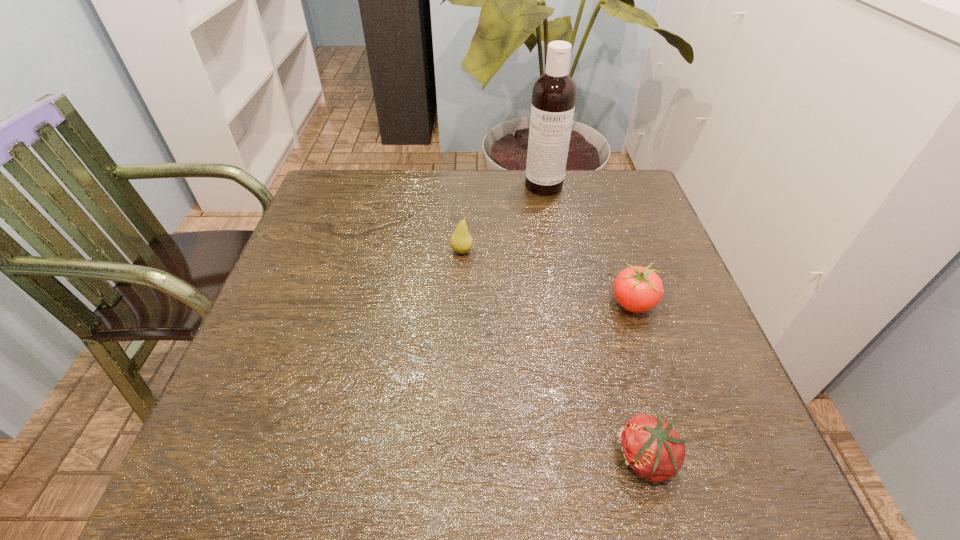
This screenshot has height=540, width=960. I want to click on vacant space located on the left of the taller tomato, so (499, 303).

The image size is (960, 540). In order to click on vacant space situated 0.110m on the back of the shorter tomato in this screenshot , I will do 623,372.

Where is `object situated at the far edge`? This screenshot has width=960, height=540. object situated at the far edge is located at coordinates (554, 93).

At what (x,y) coordinates should I click in order to perform the action: click on object that is at the near edge. Please return your answer as a coordinate pair (x, y). Looking at the image, I should click on (651, 448).

Find the location of a particular element. object at the near right corner is located at coordinates (651, 448).

At what (x,y) coordinates should I click in order to perform the action: click on free point at the far edge. Please return your answer as a coordinate pair (x, y). Looking at the image, I should click on (486, 174).

In the image, there is a desktop. Where is `vacant area at the near edge`? Image resolution: width=960 pixels, height=540 pixels. vacant area at the near edge is located at coordinates (607, 455).

Identify the location of vacant position at the left edge of the desktop. (312, 286).

The height and width of the screenshot is (540, 960). In the image, there is a desktop. In order to click on vacant space at the right edge in this screenshot , I will do `click(665, 408)`.

The height and width of the screenshot is (540, 960). What are the coordinates of `free point at the far left corner` in the screenshot? It's located at (360, 176).